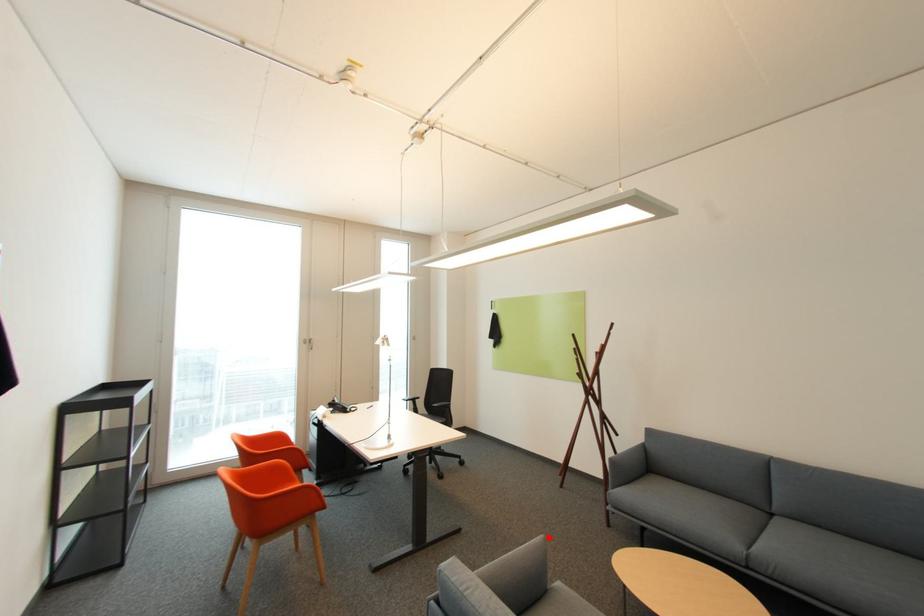
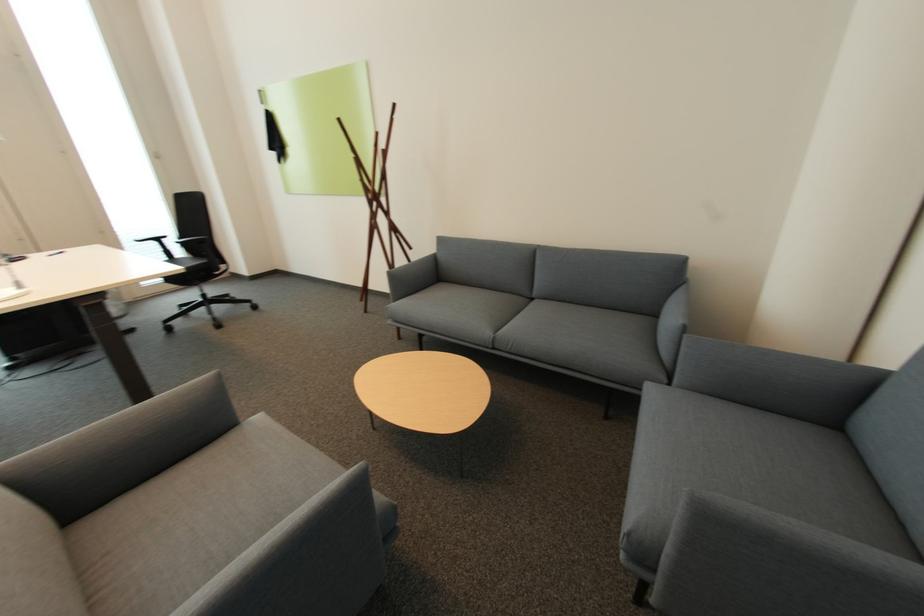
Question: I am providing you with two images of the same scene from different viewpoints. Image1 has a red point marked. In image2, the corresponding 3D location appears at what relative position? Reply with the corresponding letter.

Choices:
 (A) Closer
 (B) Farther

Answer: (B)